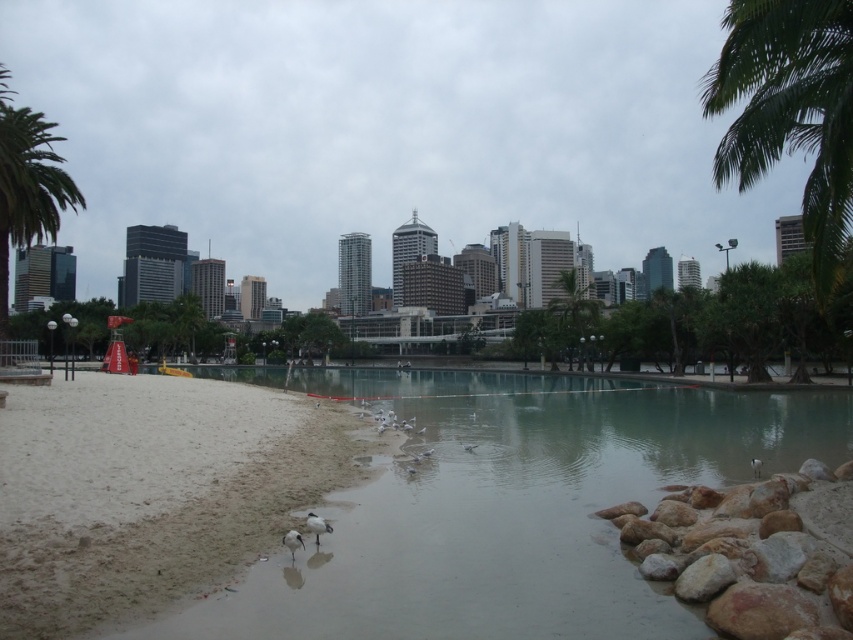
Between white sandy beach at lower left and green leafy palm tree at left, which one is positioned lower?

white sandy beach at lower left is below.

Between white sandy beach at lower left and green leafy palm tree at left, which one appears on the left side from the viewer's perspective?

green leafy palm tree at left

Does point (138, 612) lie in front of point (36, 131)?

That is True.

What are the coordinates of `white sandy beach at lower left` in the screenshot? It's located at (151, 490).

Which is above, green leafy palm tree at upper right or green leafy palm tree at center?

green leafy palm tree at upper right is above.

Is point (834, 45) positioned before point (566, 316)?

Yes, it is.

Describe the element at coordinates (790, 109) in the screenshot. Image resolution: width=853 pixels, height=640 pixels. I see `green leafy palm tree at upper right` at that location.

The height and width of the screenshot is (640, 853). I want to click on green leafy palm tree at upper right, so click(790, 109).

Is green leafy palm tree at upper right thinner than green leafy palm tree at left?

Correct, green leafy palm tree at upper right's width is less than green leafy palm tree at left's.

Is green leafy palm tree at upper right further to camera compared to green leafy palm tree at left?

No, green leafy palm tree at upper right is closer to the viewer.

The image size is (853, 640). What do you see at coordinates (790, 109) in the screenshot? I see `green leafy palm tree at upper right` at bounding box center [790, 109].

You are a GUI agent. You are given a task and a screenshot of the screen. Output one action in this format:
    pyautogui.click(x=<x>, y=<y>)
    Task: Click on the green leafy palm tree at upper right
    The width and height of the screenshot is (853, 640).
    Given the screenshot: What is the action you would take?
    click(x=790, y=109)